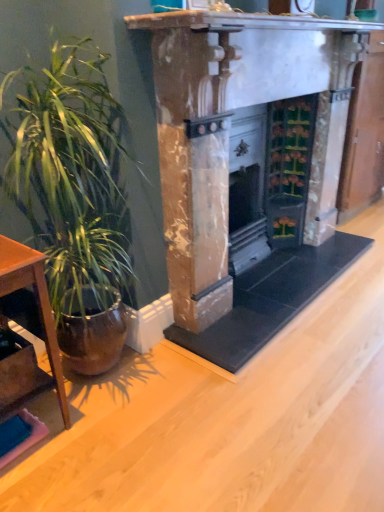
Locate an element on the screen. Image resolution: width=384 pixels, height=512 pixels. vacant area that lies between green glossy plant at left and brown wooden table at left is located at coordinates (52, 448).